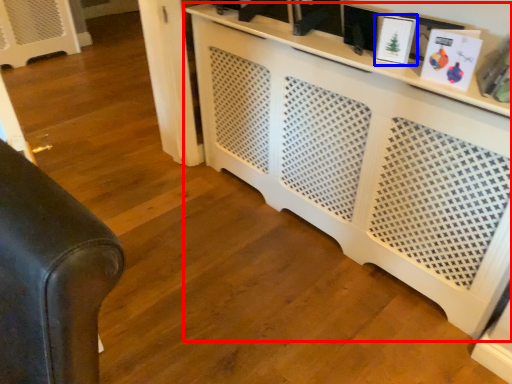
Question: Which point is closer to the camera, entertainment center (highlighted by a red box) or picture frame (highlighted by a blue box)?

Choices:
 (A) entertainment center
 (B) picture frame

Answer: (A)